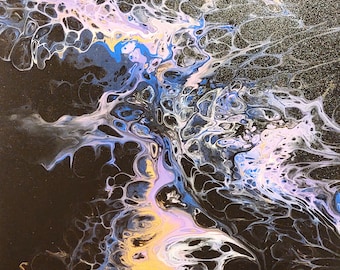
Identify the location of abstract art. (166, 92).